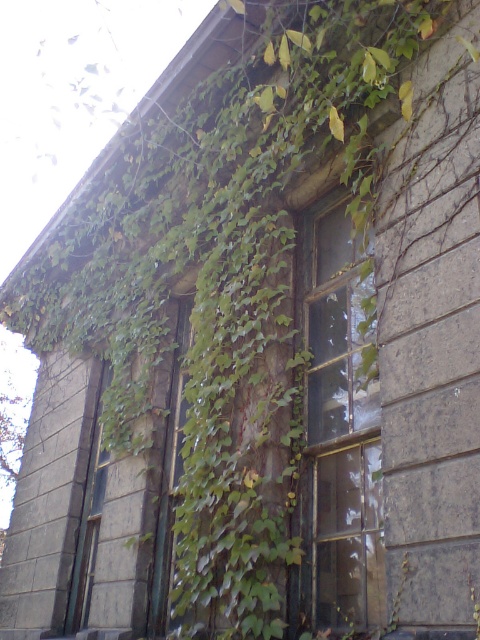
Question: Can you confirm if transparent glass window at center is wider than green mossy door at center?

Choices:
 (A) yes
 (B) no

Answer: (A)

Question: Is transparent glass window at center behind green mossy door at center?

Choices:
 (A) no
 (B) yes

Answer: (A)

Question: Is transparent glass window at center below green mossy door at center?

Choices:
 (A) no
 (B) yes

Answer: (A)

Question: Which object appears closest to the camera in this image?

Choices:
 (A) green mossy door at center
 (B) transparent glass window at center

Answer: (B)

Question: Which of the following is the closest to the observer?

Choices:
 (A) (370, 440)
 (B) (180, 371)

Answer: (A)